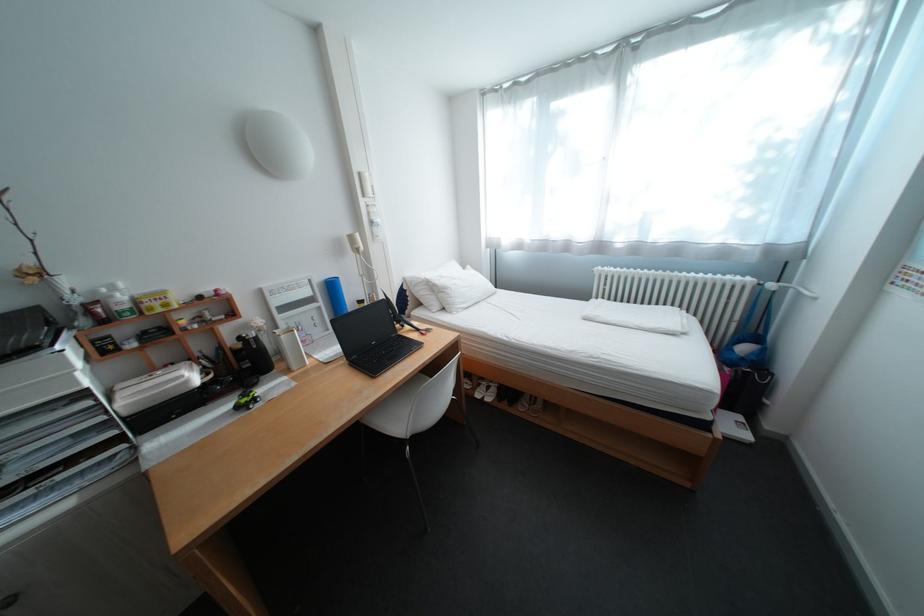
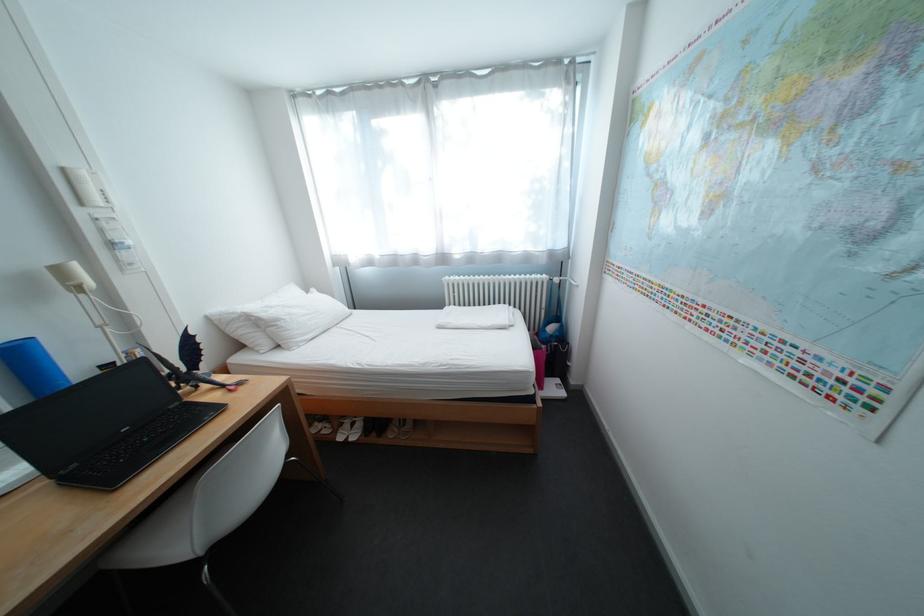
Question: The images are taken continuously from a first-person perspective. In which direction are you moving?

Choices:
 (A) Left
 (B) Right
 (C) Forward
 (D) Backward

Answer: (B)